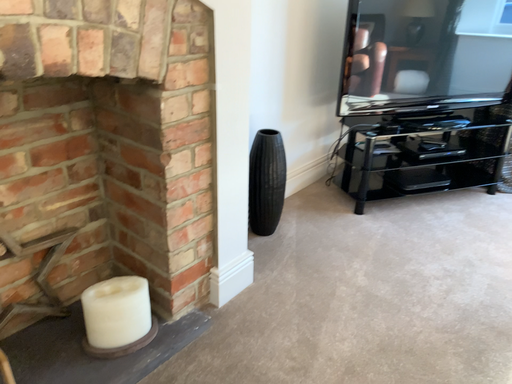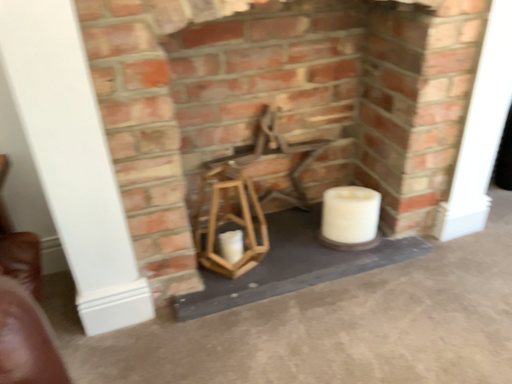
Question: How did the camera likely rotate when shooting the video?

Choices:
 (A) rotated left
 (B) rotated right

Answer: (A)